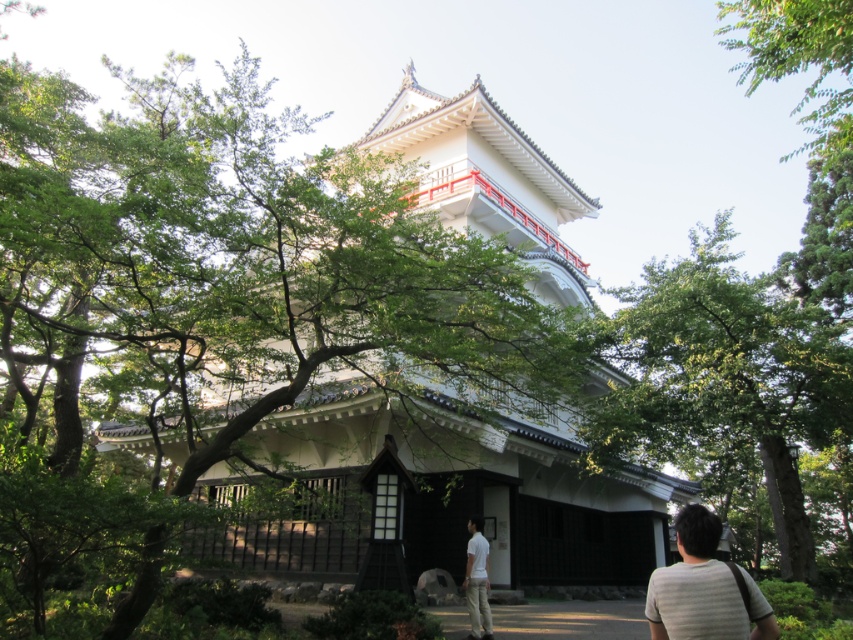
Question: Where is green leafy tree at center located in relation to striped cotton shirt at lower right in the image?

Choices:
 (A) left
 (B) right

Answer: (B)

Question: Is green leafy tree at center positioned before brown dirt path at lower center?

Choices:
 (A) yes
 (B) no

Answer: (B)

Question: Which object is the farthest from the brown dirt path at lower center?

Choices:
 (A) white cotton shirt at lower center
 (B) white wooden pagoda at center

Answer: (B)

Question: Among these points, which one is nearest to the camera?

Choices:
 (A) (476, 532)
 (B) (709, 554)

Answer: (B)

Question: From the image, what is the correct spatial relationship of white wooden pagoda at center in relation to white cotton shirt at lower center?

Choices:
 (A) right
 (B) left

Answer: (B)

Question: Considering the real-world distances, which object is closest to the brown dirt path at lower center?

Choices:
 (A) green leafy tree at center
 (B) striped cotton shirt at lower right
 (C) white cotton shirt at lower center
 (D) white wooden pagoda at center

Answer: (C)